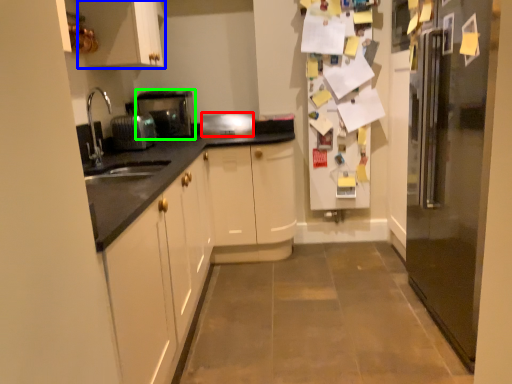
Question: Which object is positioned farthest from appliance (highlighted by a red box)? Select from cabinetry (highlighted by a blue box) and home appliance (highlighted by a green box).

Choices:
 (A) cabinetry
 (B) home appliance

Answer: (A)